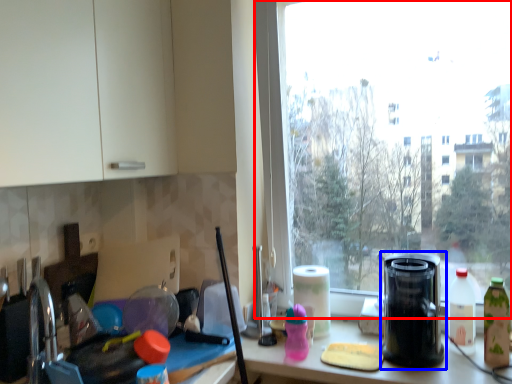
Question: Which object is further to the camera taking this photo, window (highlighted by a red box) or kitchen appliance (highlighted by a blue box)?

Choices:
 (A) window
 (B) kitchen appliance

Answer: (A)